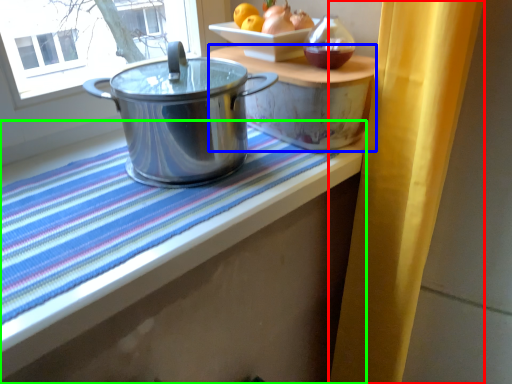
Question: Based on their relative distances, which object is farther from curtain (highlighted by a red box)? Choose from table (highlighted by a blue box) and table (highlighted by a green box).

Choices:
 (A) table
 (B) table

Answer: (B)